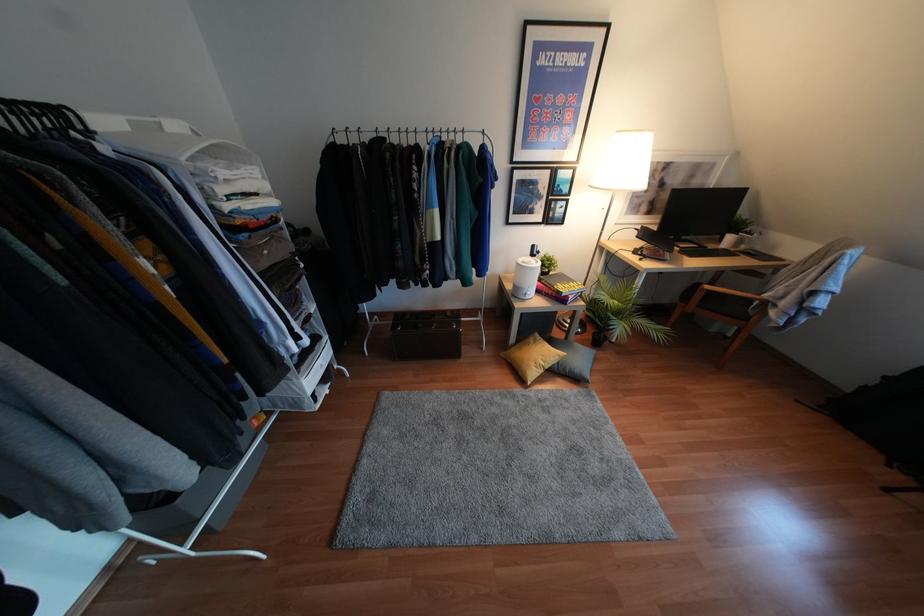
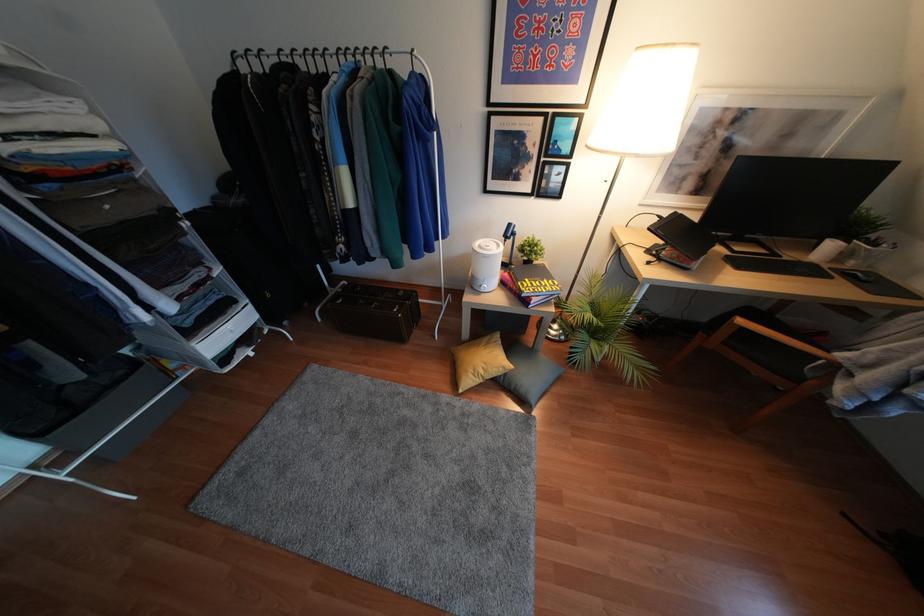
The point at (x=631, y=328) is marked in the first image. Where is the corresponding point in the second image?

(604, 357)